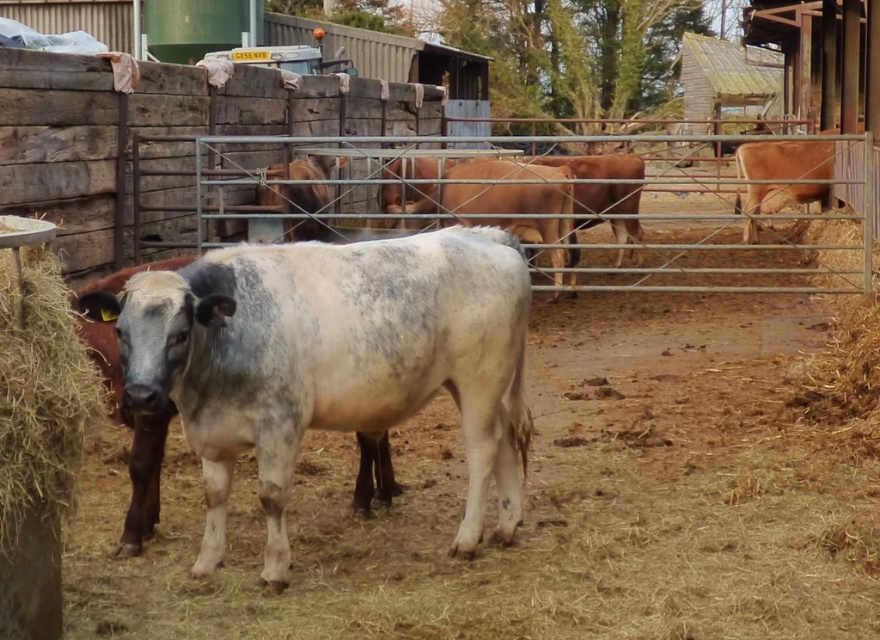
Question: Among these points, which one is farthest from the camera?

Choices:
 (A) (748, 163)
 (B) (510, 480)

Answer: (A)

Question: Where is speckled white cow at center located in relation to brown straw at left in the image?

Choices:
 (A) right
 (B) left

Answer: (A)

Question: Is brown straw at left in front of brown matte cow at right?

Choices:
 (A) no
 (B) yes

Answer: (B)

Question: Is speckled white cow at center to the left of brown matte cow at right from the viewer's perspective?

Choices:
 (A) no
 (B) yes

Answer: (B)

Question: Which point is farther to the camera?

Choices:
 (A) (41, 396)
 (B) (169, 317)

Answer: (B)

Question: Considering the real-world distances, which object is farthest from the brown matte cow at right?

Choices:
 (A) brown straw at left
 (B) speckled white cow at center

Answer: (A)